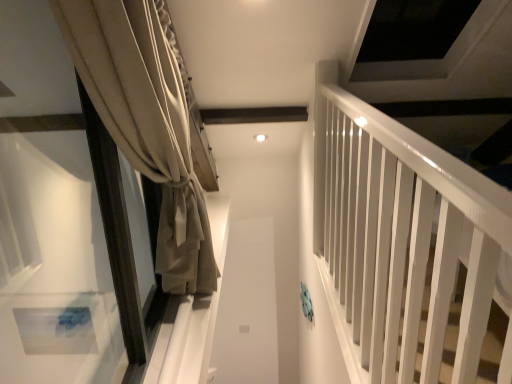
Question: Considering the positions of point (368, 205) and point (208, 231), is point (368, 205) closer or farther from the camera than point (208, 231)?

Choices:
 (A) closer
 (B) farther

Answer: (A)

Question: In the image, is white glossy rail at right positioned in front of or behind beige fabric curtain at left?

Choices:
 (A) behind
 (B) front

Answer: (B)

Question: In the image, is white glossy rail at right on the left side or the right side of beige fabric curtain at left?

Choices:
 (A) right
 (B) left

Answer: (A)

Question: From their relative heights in the image, would you say beige fabric curtain at left is taller or shorter than white glossy rail at right?

Choices:
 (A) short
 (B) tall

Answer: (B)

Question: In the image, is beige fabric curtain at left positioned in front of or behind white glossy rail at right?

Choices:
 (A) front
 (B) behind

Answer: (B)

Question: Does point (173, 238) appear closer or farther from the camera than point (387, 208)?

Choices:
 (A) farther
 (B) closer

Answer: (A)

Question: Would you say beige fabric curtain at left is to the left or to the right of white glossy rail at right in the picture?

Choices:
 (A) left
 (B) right

Answer: (A)